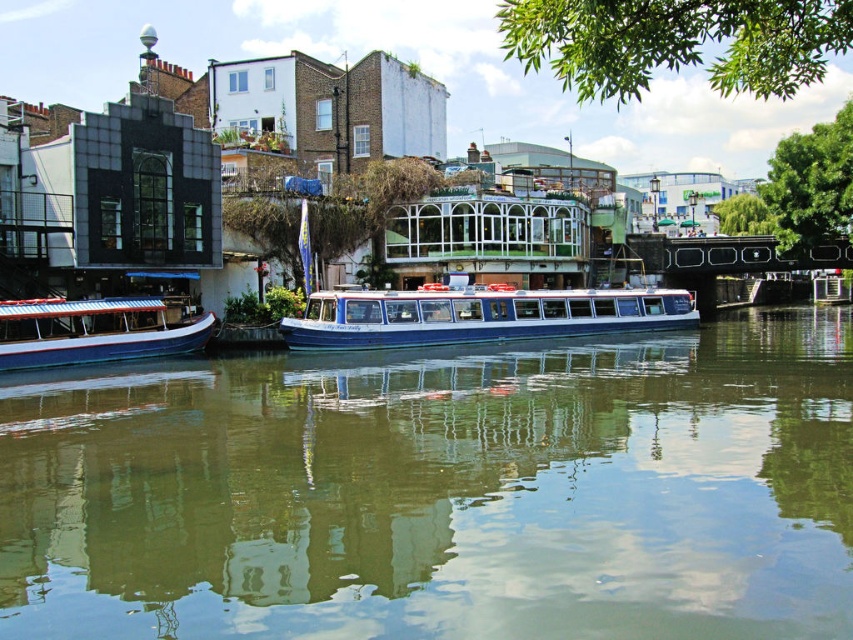
Between blue polished wood boat at center and blue polished wood boat at left, which one is positioned lower?

blue polished wood boat at left is lower down.

Which of these two, blue polished wood boat at center or blue polished wood boat at left, stands shorter?

With less height is blue polished wood boat at left.

At what (x,y) coordinates should I click in order to perform the action: click on blue polished wood boat at center. Please return your answer as a coordinate pair (x, y). Looking at the image, I should click on (477, 316).

I want to click on blue polished wood boat at center, so click(477, 316).

Is green reflective water at center wider than blue polished wood boat at center?

Correct, the width of green reflective water at center exceeds that of blue polished wood boat at center.

Find the location of a particular element. This screenshot has width=853, height=640. green reflective water at center is located at coordinates (440, 490).

Which is behind, point (648, 580) or point (206, 312)?

The point (206, 312) is more distant.

How far apart are green reflective water at center and blue polished wood boat at left?

They are 15.97 meters apart.

Who is more distant from viewer, (804, 312) or (35, 358)?

The point (804, 312) is behind.

You are a GUI agent. You are given a task and a screenshot of the screen. Output one action in this format:
    pyautogui.click(x=<x>, y=<y>)
    Task: Click on the green reflective water at center
    Image resolution: width=853 pixels, height=640 pixels.
    Given the screenshot: What is the action you would take?
    pyautogui.click(x=440, y=490)